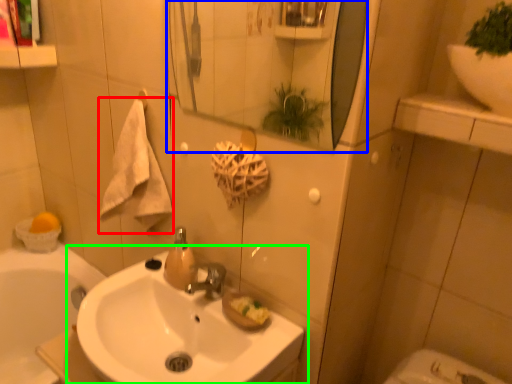
Question: Based on their relative distances, which object is farther from bath towel (highlighted by a red box)? Choose from mirror (highlighted by a blue box) and sink (highlighted by a green box).

Choices:
 (A) mirror
 (B) sink

Answer: (A)